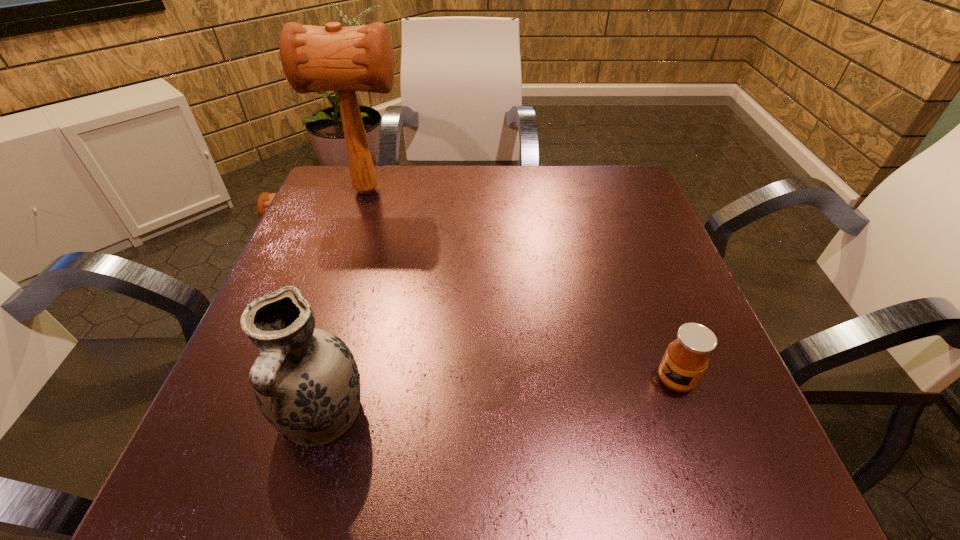
Identify the location of blank space at the far left corner of the desktop. The height and width of the screenshot is (540, 960). (x=379, y=178).

In the image, there is a desktop. Where is `free space at the far right corner`? The image size is (960, 540). free space at the far right corner is located at coordinates (622, 218).

The image size is (960, 540). Find the location of `free space at the near right corner of the desktop`. free space at the near right corner of the desktop is located at coordinates (721, 448).

Where is `vacant area between the tallest object and the rightmost object`? This screenshot has height=540, width=960. vacant area between the tallest object and the rightmost object is located at coordinates (521, 285).

At what (x,y) coordinates should I click in order to perform the action: click on vacant space that is in between the second tallest object and the shortest object. Please return your answer as a coordinate pair (x, y). This screenshot has height=540, width=960. Looking at the image, I should click on (498, 398).

Find the location of `free space between the rightmost object and the vase`. free space between the rightmost object and the vase is located at coordinates (498, 398).

Find the location of a particular element. This screenshot has height=540, width=960. unoccupied position between the rightmost object and the farthest object is located at coordinates (521, 285).

The height and width of the screenshot is (540, 960). Find the location of `free space between the honey and the second tallest object`. free space between the honey and the second tallest object is located at coordinates (498, 398).

The width and height of the screenshot is (960, 540). I want to click on vacant area that lies between the rightmost object and the vase, so click(498, 398).

Locate an element on the screen. blank region between the honey and the vase is located at coordinates (498, 398).